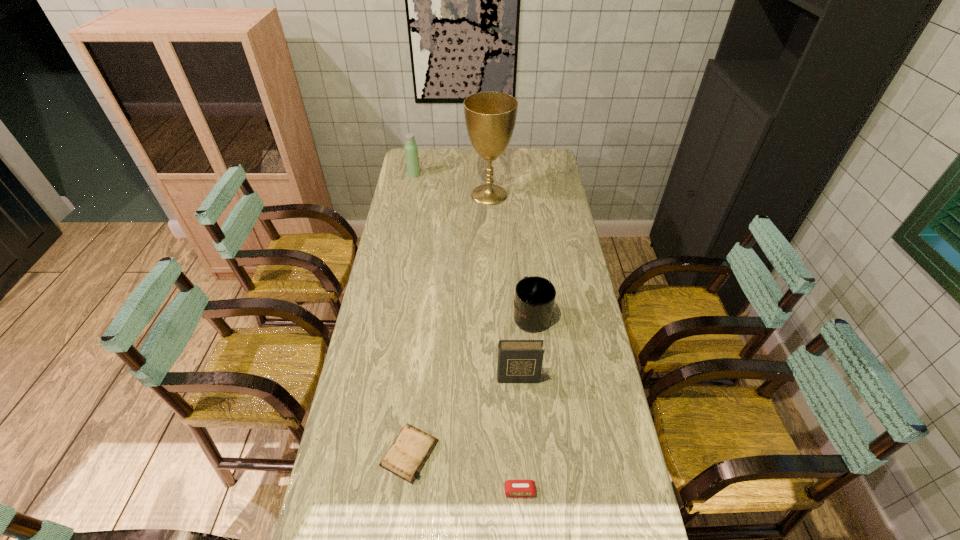
Where is `the nearer diary`? the nearer diary is located at coordinates (405, 458).

Identify the location of the second object from left to right. (405, 458).

This screenshot has width=960, height=540. I want to click on free space located 0.050m on the front of the fifth nearest object, so click(x=490, y=215).

You are a GUI agent. You are given a task and a screenshot of the screen. Output one action in this format:
    pyautogui.click(x=<x>, y=<y>)
    Task: Click on the free point located 0.050m on the right of the thermos bottle
    Image resolution: width=960 pixels, height=540 pixels.
    Given the screenshot: What is the action you would take?
    pyautogui.click(x=430, y=174)

At what (x,y) coordinates should I click in order to perform the action: click on free location located 0.120m on the front cover of the taller diary. Please return your answer as a coordinate pair (x, y). The height and width of the screenshot is (540, 960). Looking at the image, I should click on (520, 419).

Identify the location of free space located 0.120m with the handle on the side of the third farthest object. Image resolution: width=960 pixels, height=540 pixels. (527, 273).

Where is `free location located 0.120m with the handle on the side of the third farthest object`? The height and width of the screenshot is (540, 960). free location located 0.120m with the handle on the side of the third farthest object is located at coordinates (527, 273).

The width and height of the screenshot is (960, 540). Find the location of `vacant area situated with the handle on the side of the third farthest object`. vacant area situated with the handle on the side of the third farthest object is located at coordinates (528, 279).

Locate an element on the screen. The height and width of the screenshot is (540, 960). vacant space situated on the right of the shortest object is located at coordinates (579, 453).

Where is `object located at the far edge`? Image resolution: width=960 pixels, height=540 pixels. object located at the far edge is located at coordinates (411, 150).